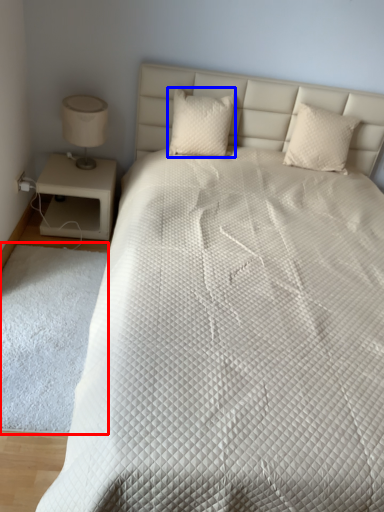
Question: Among these objects, which one is farthest to the camera, mat (highlighted by a red box) or pillow (highlighted by a blue box)?

Choices:
 (A) mat
 (B) pillow

Answer: (B)